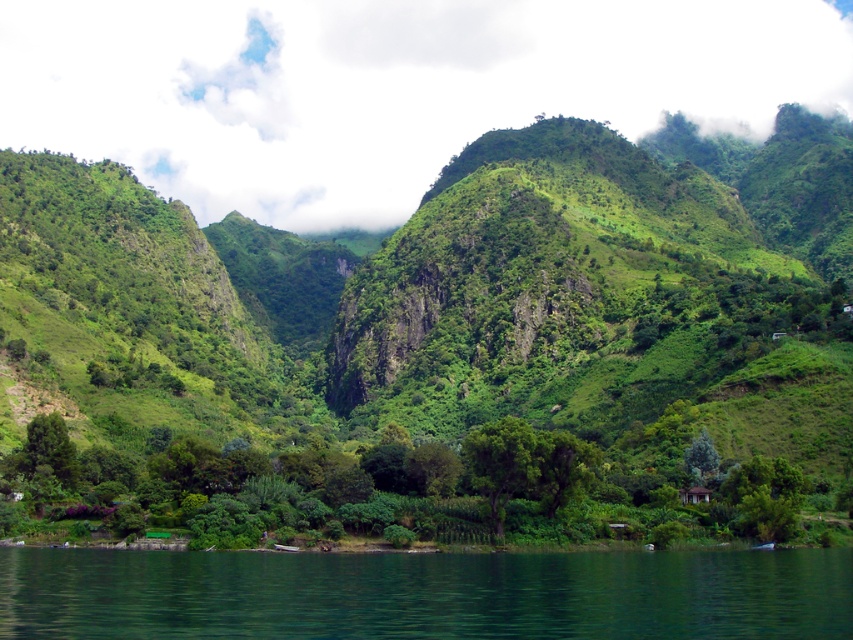
Question: Which is nearer to the green liquid water at lower center?

Choices:
 (A) green leafy trees at center
 (B) white fluffy cloud at upper center
 (C) green leafy mountain at center

Answer: (A)

Question: Which of these objects is positioned farthest from the green liquid water at lower center?

Choices:
 (A) green leafy mountain at center
 (B) green leafy trees at center

Answer: (A)

Question: Can you confirm if green leafy trees at center is positioned to the right of green liquid water at lower center?

Choices:
 (A) yes
 (B) no

Answer: (B)

Question: Is white fluffy cloud at upper center below green leafy trees at center?

Choices:
 (A) no
 (B) yes

Answer: (A)

Question: Can you confirm if green leafy mountain at center is smaller than green leafy trees at center?

Choices:
 (A) no
 (B) yes

Answer: (A)

Question: Which object appears farthest from the camera in this image?

Choices:
 (A) green leafy mountain at center
 (B) white fluffy cloud at upper center

Answer: (B)